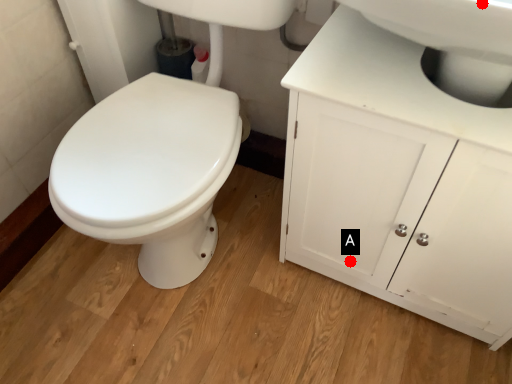
Question: Two points are circled on the image, labeled by A and B beside each circle. Which point appears closest to the camera in this image?

Choices:
 (A) A is closer
 (B) B is closer

Answer: (B)